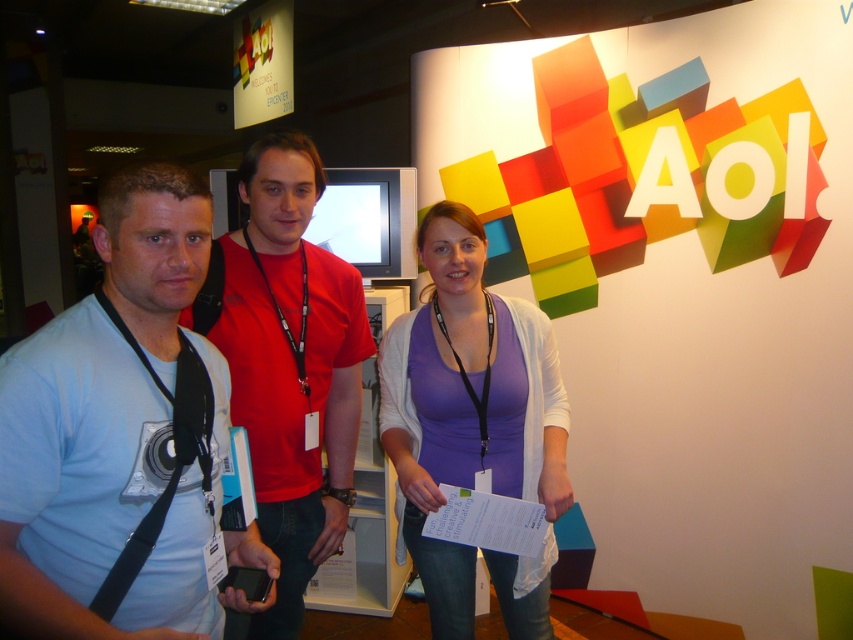
Who is positioned more to the left, matte blue shirt at left or purple matte shirt at center?

matte blue shirt at left is more to the left.

Is the position of matte blue shirt at left more distant than that of purple matte shirt at center?

That is False.

What do you see at coordinates (90, 492) in the screenshot?
I see `matte blue shirt at left` at bounding box center [90, 492].

This screenshot has height=640, width=853. I want to click on matte blue shirt at left, so click(x=90, y=492).

Is matte blue shirt at left taller than red cotton t-shirt at center?

No.

Is the position of matte blue shirt at left more distant than that of red cotton t-shirt at center?

No.

Is point (91, 301) positioned after point (323, 515)?

No, it is in front of (323, 515).

Identify the location of matte blue shirt at left. (90, 492).

Does purple matte shirt at center have a greater height compared to red cotton t-shirt at center?

In fact, purple matte shirt at center may be shorter than red cotton t-shirt at center.

Between purple matte shirt at center and red cotton t-shirt at center, which one has less height?

purple matte shirt at center is shorter.

The height and width of the screenshot is (640, 853). What do you see at coordinates (467, 404) in the screenshot?
I see `purple matte shirt at center` at bounding box center [467, 404].

I want to click on purple matte shirt at center, so click(467, 404).